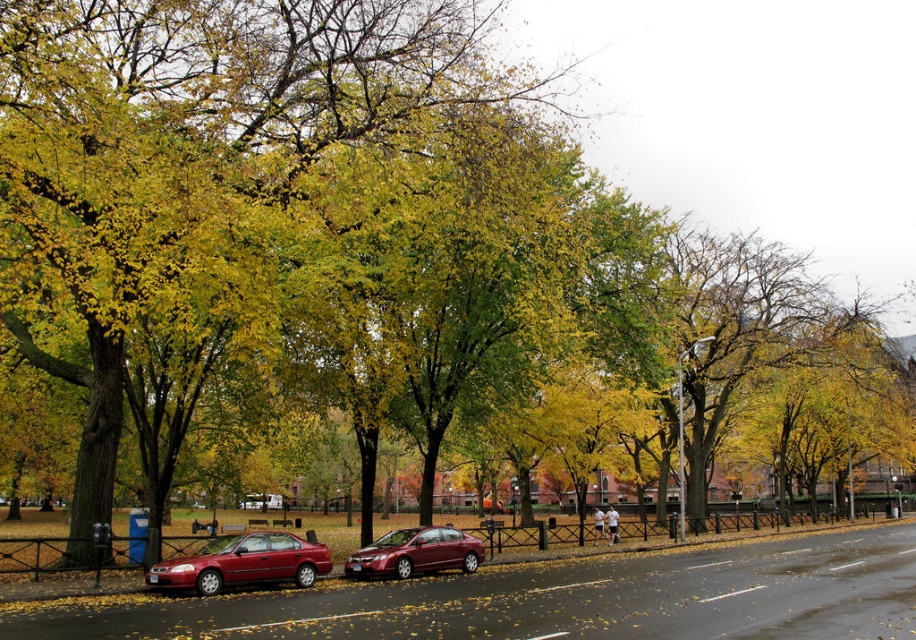
You are a delivery person who needs to cross the street between the two cars. The cars are parked on the curb. The street is wet and reflective. The distance between the shiny red sedan at center and the other car is 17.97 meters. Can you safely cross the street between them without stepping into the road? Please explain your reasoning.

The distance between the shiny red sedan at center and the other car is 17.97 meters. Since the cars are parked on the curb, there is a significant gap between them, allowing you to safely cross the street between them without stepping into the road.

You are standing on the sidewalk looking at the two cars parked on the street. Which car, the shiny red sedan at center or the glossy metallic sedan at center, is positioned closer to you?

The shiny red sedan at center is closer to the viewer than the glossy metallic sedan at center.